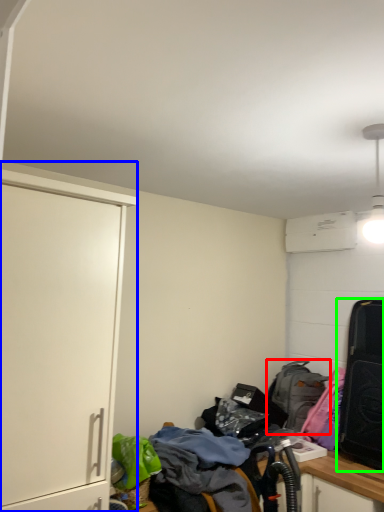
Question: Which object is the closest to the backpack (highlighted by a red box)? Choose among these: cabinetry (highlighted by a blue box) or luggage and bags (highlighted by a green box).

Choices:
 (A) cabinetry
 (B) luggage and bags

Answer: (B)